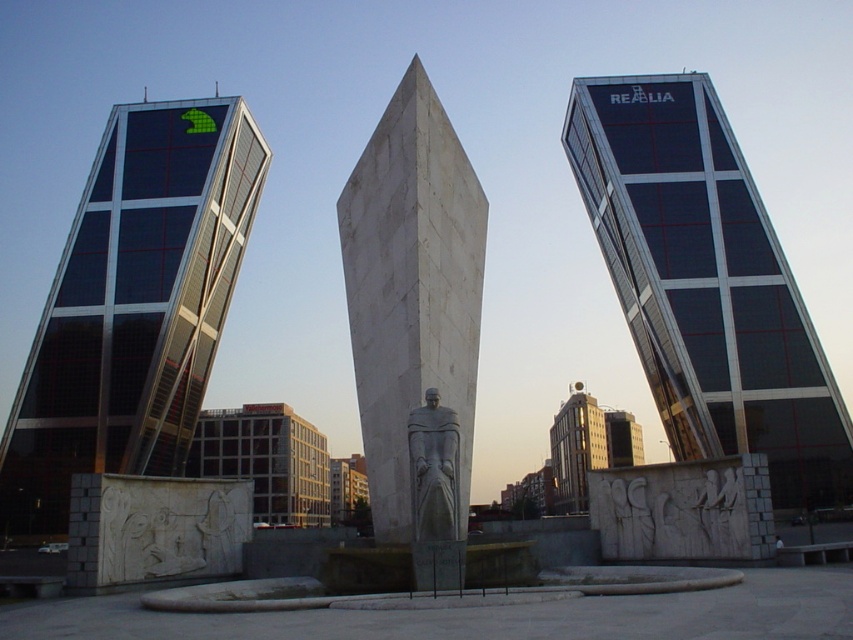
You are an architect planning to install a new light pole between the dark glass skyscraper at center and the white marble monument at center. The light pole requires a minimum of 150 feet of space between the two structures to be safely installed. Can the light pole be placed there?

The dark glass skyscraper at center is 166.68 feet from the white marble monument at center. Since the required minimum space is 150 feet, the light pole can be safely installed between them as the distance is sufficient.

You are an architect visiting Madrid and want to take a photo of both the white marble monument at center and the gray stone statue at center. Since you can only focus on one object at a time, which one should you adjust your camera to focus on first if you want to capture both in the same frame?

The white marble monument at center is taller than the gray stone statue at center, so you should focus on the white marble monument at center first to ensure both are in the frame.

You are a tourist standing in front of the two central structures in the image. The white marble monument at center and the gray stone statue at center. Which one is positioned higher up?

The white marble monument at center is located above the gray stone statue at center, so it is positioned higher up.